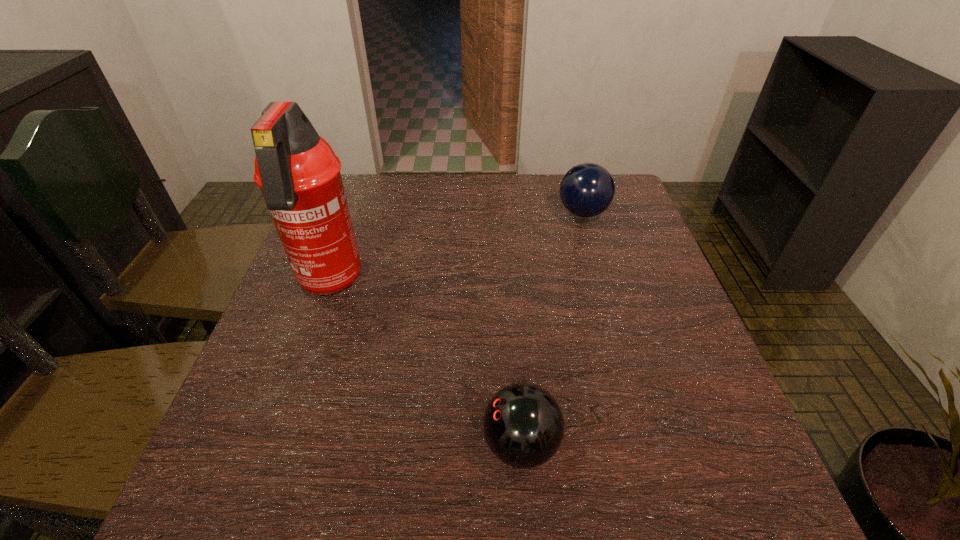
The width and height of the screenshot is (960, 540). In the image, there is a desktop. Identify the location of vacant region at the left edge. (231, 403).

At what (x,y) coordinates should I click in order to perform the action: click on vacant space at the right edge of the desktop. Please return your answer as a coordinate pair (x, y). The height and width of the screenshot is (540, 960). Looking at the image, I should click on (657, 326).

Identify the location of free region at the far left corner of the desktop. This screenshot has width=960, height=540. (383, 202).

Image resolution: width=960 pixels, height=540 pixels. I want to click on vacant region at the near left corner of the desktop, so click(x=252, y=509).

Identify the location of vacant space at the far right corner of the desktop. (640, 212).

Locate an element on the screen. vacant space at the near right corner of the desktop is located at coordinates (661, 473).

The image size is (960, 540). Identify the location of unoccupied position between the right bowling ball and the second nearest object. (456, 248).

You are a GUI agent. You are given a task and a screenshot of the screen. Output one action in this format:
    pyautogui.click(x=<x>, y=<y>)
    Task: Click on the vacant point located between the tallest object and the nearest object
    
    Given the screenshot: What is the action you would take?
    [424, 363]

You are a GUI agent. You are given a task and a screenshot of the screen. Output one action in this format:
    pyautogui.click(x=<x>, y=<y>)
    Task: Click on the free space between the nearer bowling ball and the fire extinguisher
    Image resolution: width=960 pixels, height=540 pixels.
    Given the screenshot: What is the action you would take?
    pyautogui.click(x=424, y=363)

Identify the location of free space between the second object from right to left and the second nearest object. (424, 363).